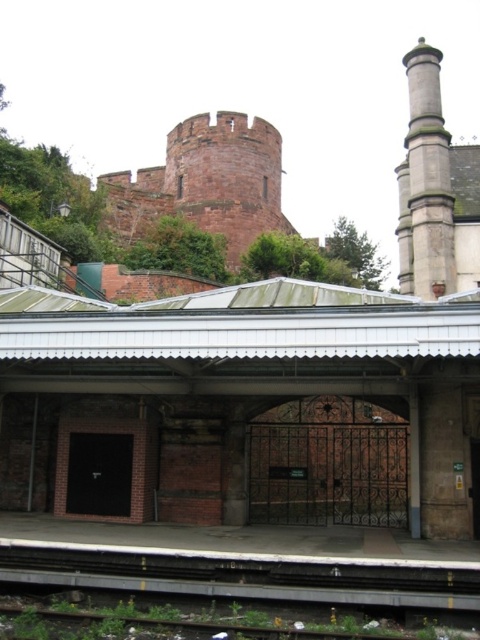
Is the position of smooth concrete train track at bottom more distant than that of reddish-brown stone tower at upper center?

No, smooth concrete train track at bottom is closer to the viewer.

Between smooth concrete train track at bottom and reddish-brown stone tower at upper center, which one has more height?

reddish-brown stone tower at upper center is taller.

Who is more distant from viewer, (422, 577) or (107, 177)?

The point (107, 177) is behind.

Locate an element on the screen. Image resolution: width=480 pixels, height=640 pixels. smooth concrete train track at bottom is located at coordinates (249, 577).